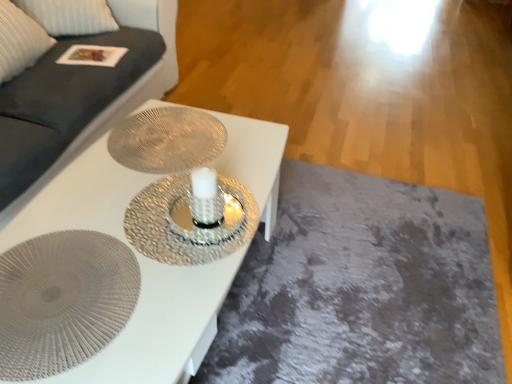
Find the location of a particular element. The width and height of the screenshot is (512, 384). free spot to the right of dark gray fabric couch at upper left is located at coordinates (312, 140).